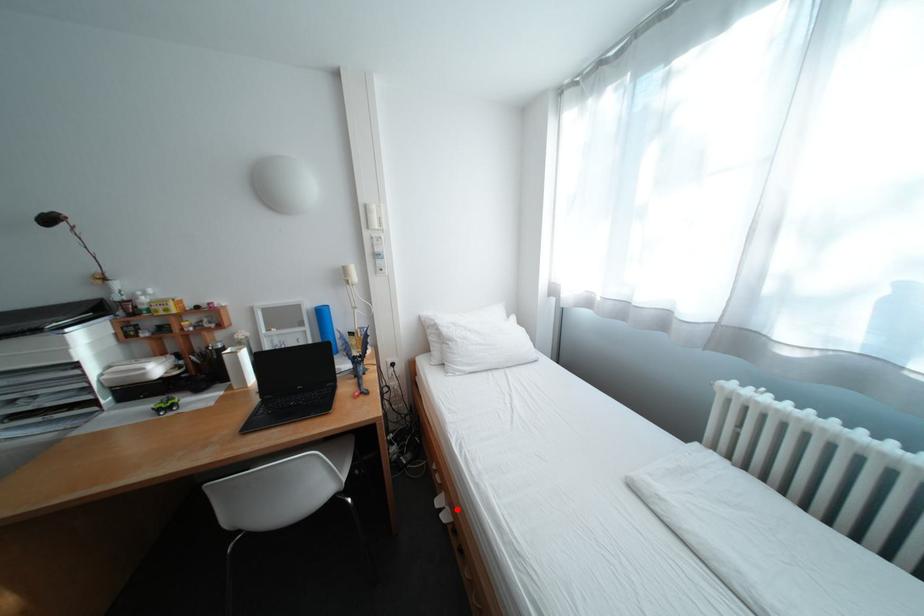
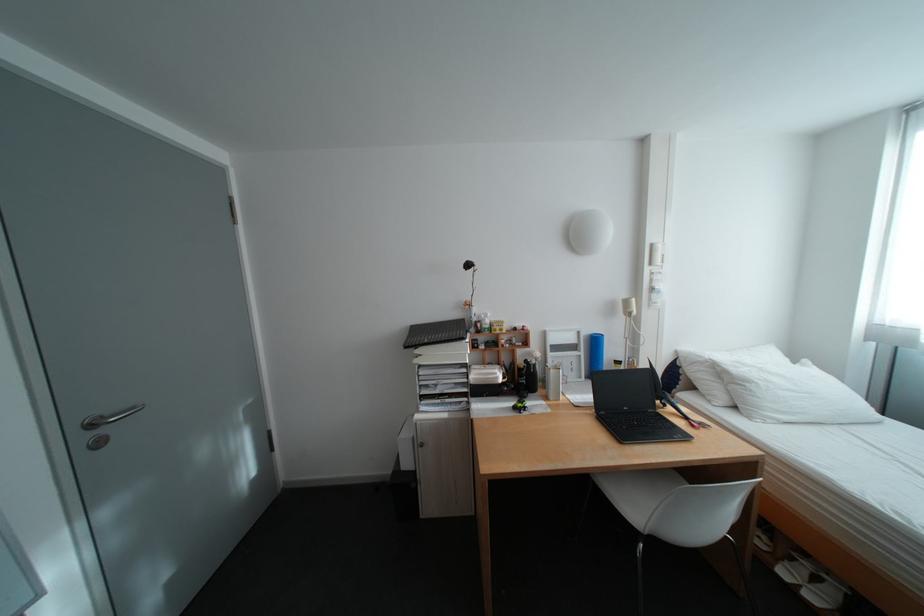
Question: A red point is marked in image1. In image2, is the corresponding 3D point closer to the camera or farther? Reply with the corresponding letter.

Choices:
 (A) The corresponding 3D point is closer.
 (B) The corresponding 3D point is farther.

Answer: (A)